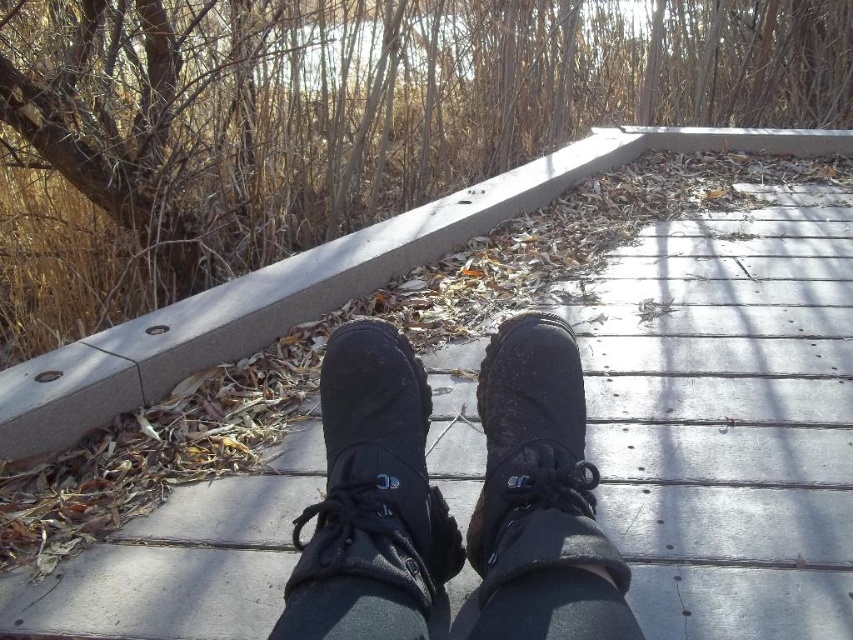
Question: Does black leather boots at center appear on the right side of black leather boot at center?

Choices:
 (A) no
 (B) yes

Answer: (B)

Question: Can you confirm if black leather boots at center is wider than matte black boot at center?

Choices:
 (A) no
 (B) yes

Answer: (B)

Question: Which point is farther from the camera taking this photo?

Choices:
 (A) (383, 356)
 (B) (344, 371)

Answer: (B)

Question: Is black leather boots at center below black leather boot at center?

Choices:
 (A) no
 (B) yes

Answer: (A)

Question: Which object appears farthest from the camera in this image?

Choices:
 (A) black leather boots at center
 (B) black leather boot at center

Answer: (B)

Question: Among these points, which one is nearest to the camera?

Choices:
 (A) (543, 541)
 (B) (392, 618)

Answer: (B)